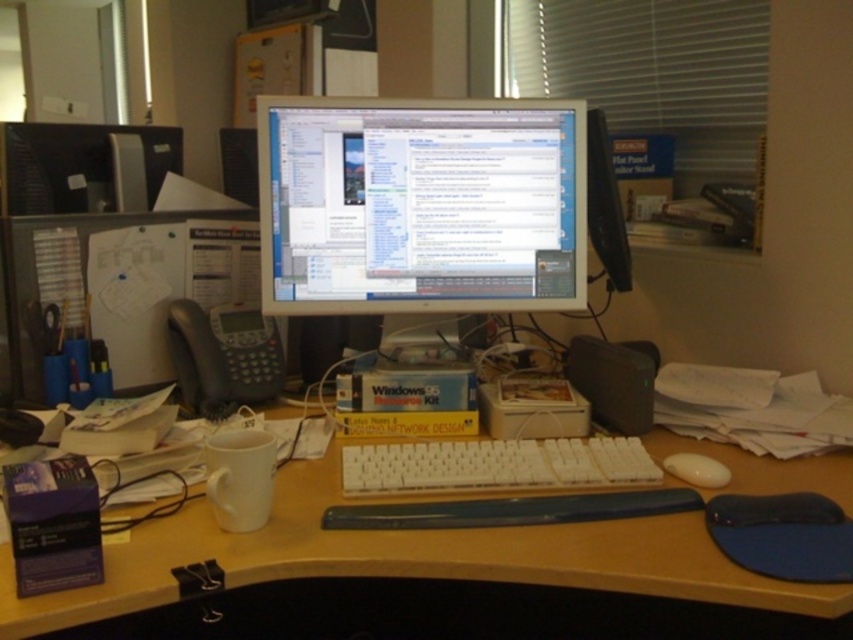
Question: Among these points, which one is farthest from the camera?

Choices:
 (A) [x=138, y=540]
 (B) [x=697, y=109]
 (C) [x=386, y=474]
 (D) [x=728, y=480]

Answer: (B)

Question: Is wooden desk at center to the right of white blinds at upper right from the viewer's perspective?

Choices:
 (A) no
 (B) yes

Answer: (A)

Question: Estimate the real-world distances between objects in this image. Which object is closer to the white plastic keyboard at center?

Choices:
 (A) wooden desk at center
 (B) white matte mouse at lower right

Answer: (A)

Question: Does white blinds at upper right have a larger size compared to white matte mouse at lower right?

Choices:
 (A) yes
 (B) no

Answer: (A)

Question: Does white plastic keyboard at center lie behind white matte mouse at lower right?

Choices:
 (A) yes
 (B) no

Answer: (B)

Question: Which of these objects is positioned closest to the white plastic keyboard at center?

Choices:
 (A) white matte mouse at lower right
 (B) wooden desk at center

Answer: (B)